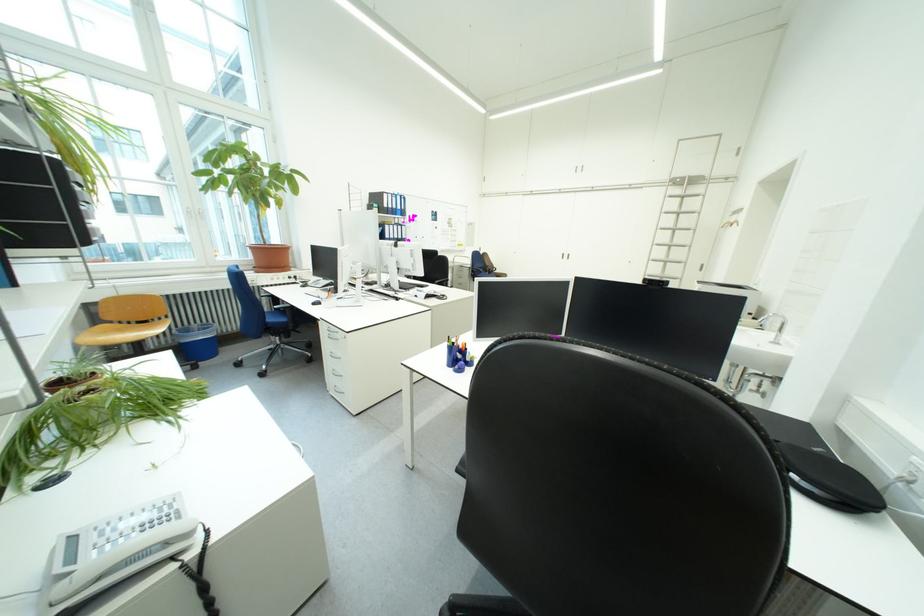
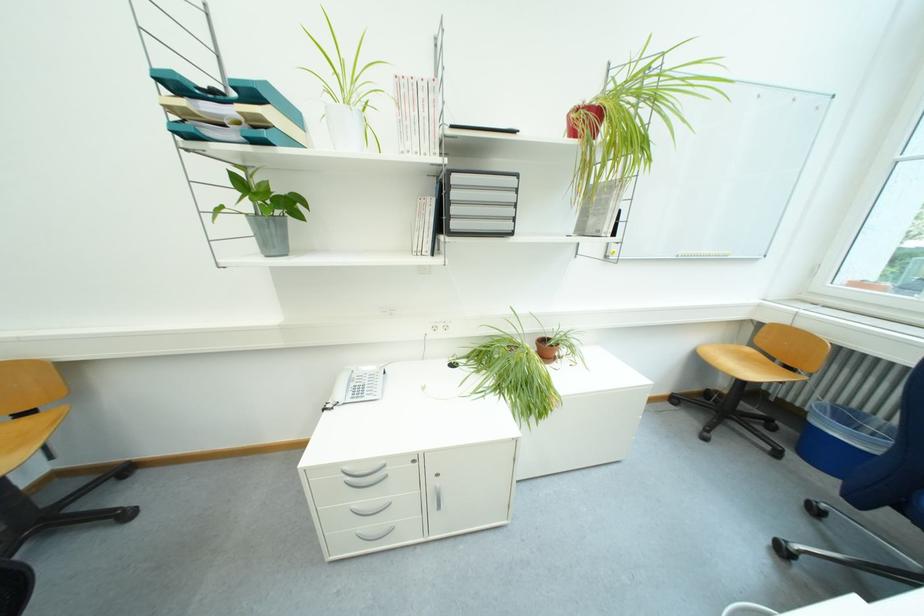
Find the pixel in the second image that matches (199,333) in the first image.

(856, 418)